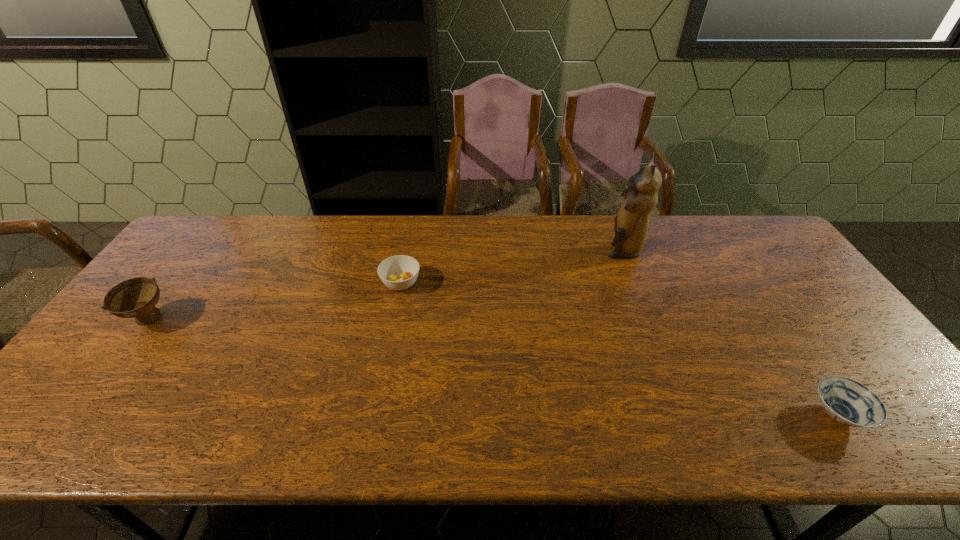
Identify the location of free space at the near edge of the desktop. (624, 432).

Locate an element on the screen. Image resolution: width=960 pixels, height=540 pixels. free spot at the left edge of the desktop is located at coordinates (202, 286).

At what (x,y) coordinates should I click in order to perform the action: click on free spot at the right edge of the desktop. Please return your answer as a coordinate pair (x, y). Looking at the image, I should click on (811, 292).

Locate an element on the screen. vacant area between the second farthest soup bowl and the nearest soup bowl is located at coordinates (493, 367).

Where is `free space between the second object from right to left and the rightmost soup bowl`? free space between the second object from right to left and the rightmost soup bowl is located at coordinates (731, 332).

Where is `empty location between the tallest soup bowl and the nearest soup bowl`? empty location between the tallest soup bowl and the nearest soup bowl is located at coordinates click(x=493, y=367).

The image size is (960, 540). Find the location of `free point between the farthest soup bowl and the nearest object`. free point between the farthest soup bowl and the nearest object is located at coordinates (619, 349).

Locate an element on the screen. The image size is (960, 540). free space between the third nearest object and the leftmost object is located at coordinates (275, 301).

The image size is (960, 540). Identify the location of free spot between the second soup bowl from left to right and the third shortest object. (275, 301).

Identify the location of free space between the nearest soup bowl and the tallest object. The height and width of the screenshot is (540, 960). (731, 332).